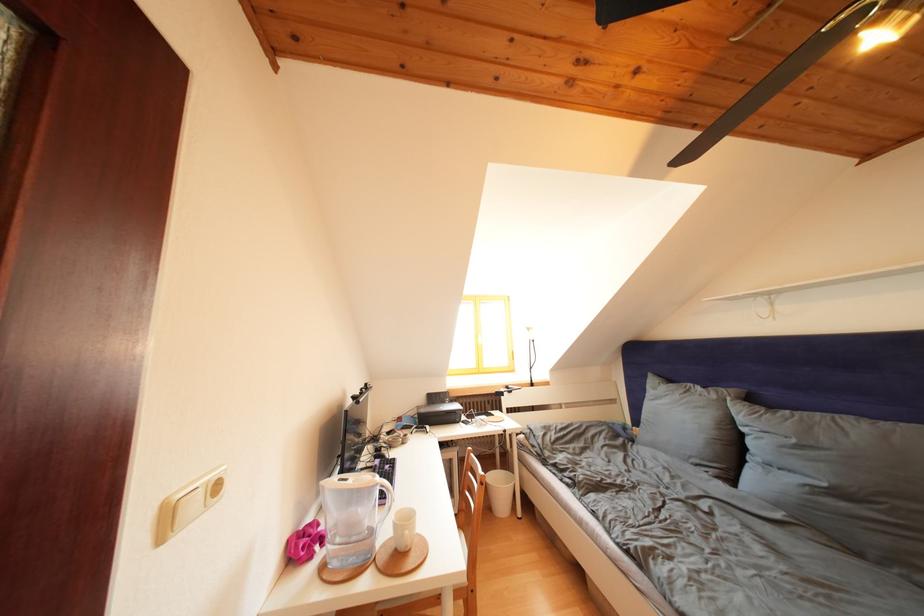
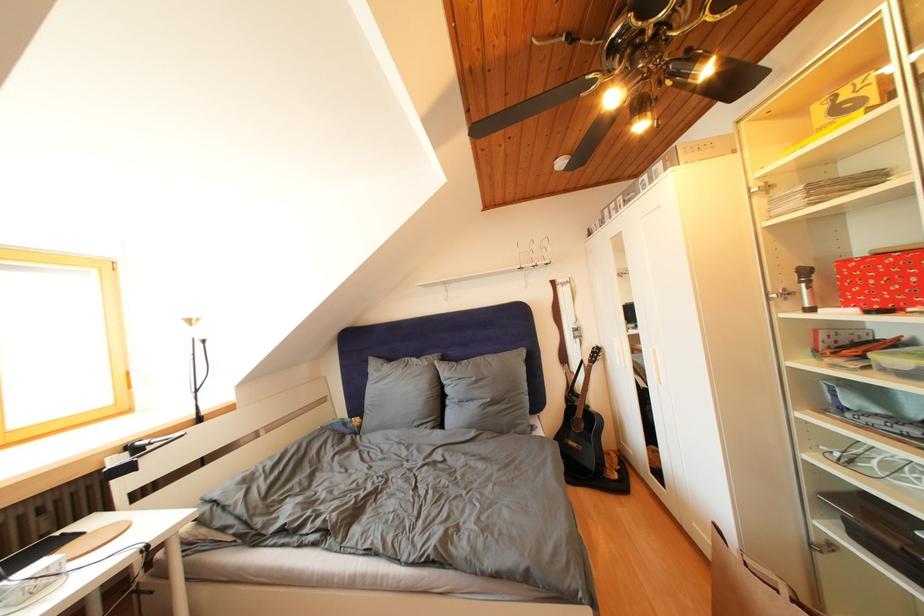
Question: How did the camera likely rotate?

Choices:
 (A) Left
 (B) Right
 (C) Up
 (D) Down

Answer: (B)